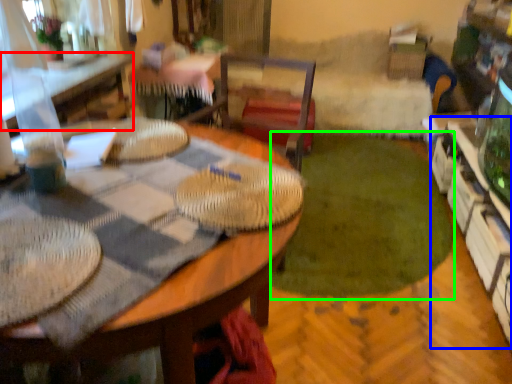
Question: Which is nearer to the table (highlighted by a red box)? shelf (highlighted by a blue box) or grass (highlighted by a green box).

Choices:
 (A) shelf
 (B) grass

Answer: (B)